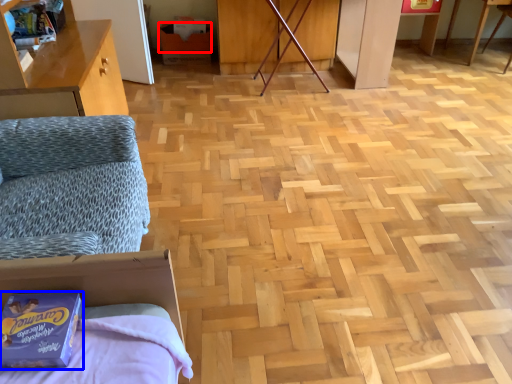
Question: Which point is further to the camera, cardboard box (highlighted by a red box) or package (highlighted by a blue box)?

Choices:
 (A) cardboard box
 (B) package

Answer: (A)